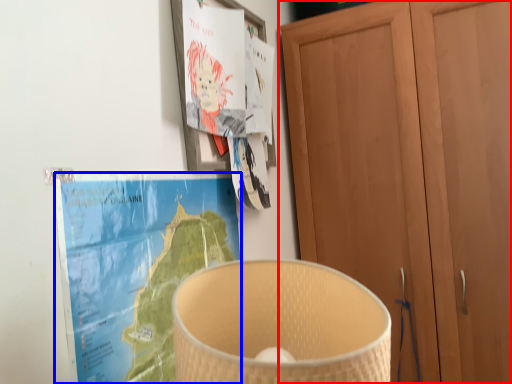
Question: Among these objects, which one is farthest to the camera, cupboard (highlighted by a red box) or paperback book (highlighted by a blue box)?

Choices:
 (A) cupboard
 (B) paperback book

Answer: (A)